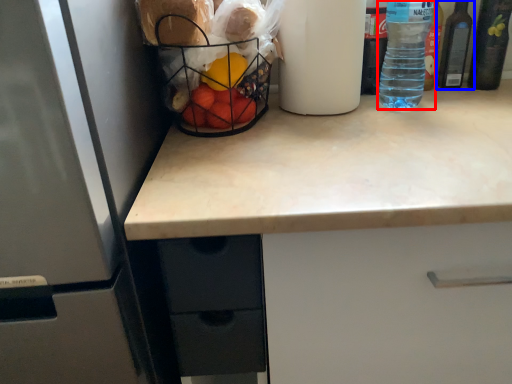
Question: Which object is further to the camera taking this photo, bottle (highlighted by a red box) or bottle (highlighted by a blue box)?

Choices:
 (A) bottle
 (B) bottle

Answer: (B)